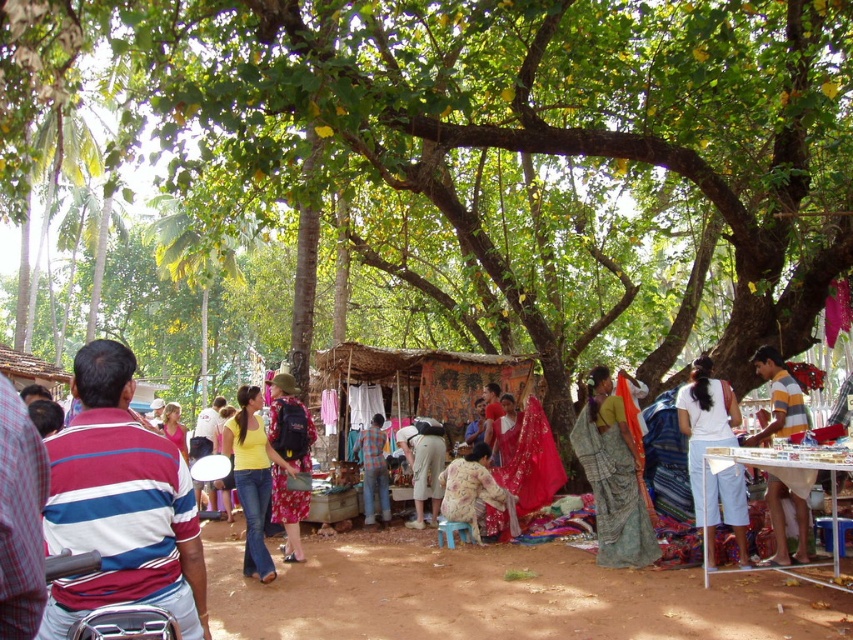
You are a customer at the market and want to buy both the floral dress at center and the pink fabric dress at center. However, you notice that one is covering part of the other. Which dress is currently visible on top?

The floral dress at center is positioned over the pink fabric dress at center, so the floral dress at center is visible on top.

You are a customer at the market and want to pick up the white cotton shirt at center. If you are currently standing 3 meters away from it, how much further do you need to walk to reach it?

You need to walk 3.64 meters further to reach the white cotton shirt at center because they are 6.64 meters apart.